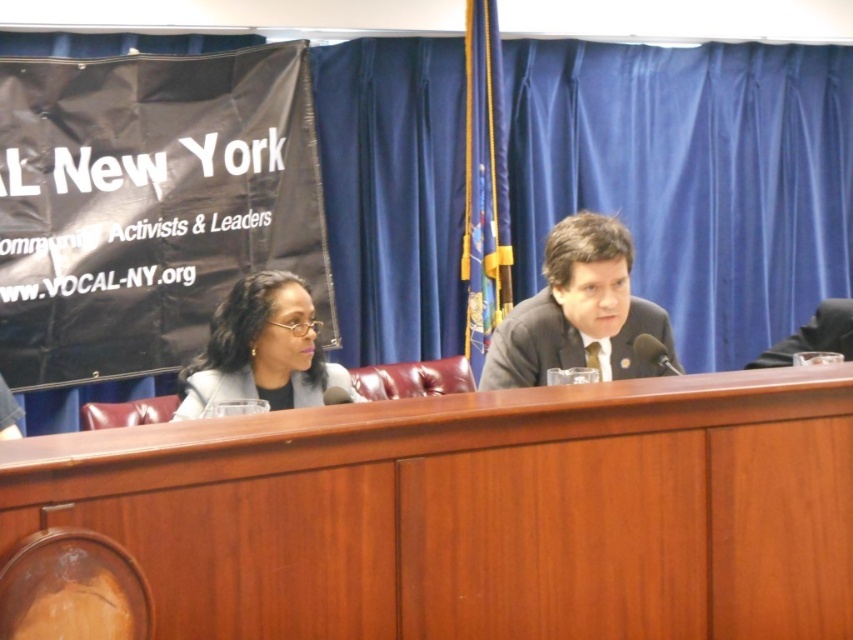
Which is above, wooden table at center or matte black glasses at center?

matte black glasses at center is higher up.

Which is more to the right, wooden table at center or matte black glasses at center?

wooden table at center is more to the right.

Between point (625, 476) and point (183, 378), which one is positioned behind?

Positioned behind is point (183, 378).

The height and width of the screenshot is (640, 853). I want to click on wooden table at center, so click(479, 512).

Does wooden table at center have a lesser width compared to dark gray suit at center?

No, wooden table at center is not thinner than dark gray suit at center.

Is wooden table at center positioned in front of dark gray suit at center?

Yes, it is.

Locate an element on the screen. wooden table at center is located at coordinates (479, 512).

Does dark gray suit at center appear on the right side of matte black glasses at center?

Indeed, dark gray suit at center is positioned on the right side of matte black glasses at center.

Between point (585, 211) and point (252, 365), which one is positioned in front?

Point (252, 365) is in front.

Identify the location of dark gray suit at center. Image resolution: width=853 pixels, height=640 pixels. (578, 310).